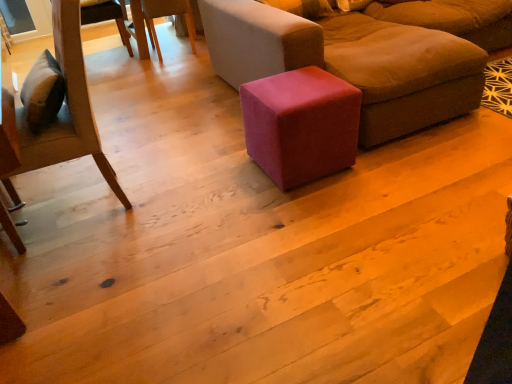
Question: Does wooden chair at upper left, marked as the second chair in a front-to-back arrangement, have a smaller size compared to velvet pink cube at center?

Choices:
 (A) no
 (B) yes

Answer: (A)

Question: Considering the relative sizes of wooden chair at upper left, the 1th chair positioned from the top, and velvet pink cube at center in the image provided, is wooden chair at upper left, the 1th chair positioned from the top, wider than velvet pink cube at center?

Choices:
 (A) yes
 (B) no

Answer: (A)

Question: Considering the relative sizes of wooden chair at upper left, the 1th chair positioned from the back, and velvet pink cube at center in the image provided, is wooden chair at upper left, the 1th chair positioned from the back, thinner than velvet pink cube at center?

Choices:
 (A) yes
 (B) no

Answer: (B)

Question: Can you confirm if wooden chair at upper left, the 1th chair positioned from the top, is positioned to the left of velvet pink cube at center?

Choices:
 (A) no
 (B) yes

Answer: (B)

Question: From the image's perspective, does wooden chair at upper left, marked as the second chair in a front-to-back arrangement, appear lower than velvet pink cube at center?

Choices:
 (A) no
 (B) yes

Answer: (A)

Question: Can you confirm if wooden chair at upper left, marked as the second chair in a front-to-back arrangement, is bigger than velvet pink cube at center?

Choices:
 (A) no
 (B) yes

Answer: (B)

Question: Is velvet pink cube at center far away from velvet brown ottoman at center?

Choices:
 (A) no
 (B) yes

Answer: (A)

Question: Is velvet pink cube at center completely or partially outside of velvet brown ottoman at center?

Choices:
 (A) no
 (B) yes

Answer: (A)

Question: From a real-world perspective, is velvet pink cube at center on velvet brown ottoman at center?

Choices:
 (A) no
 (B) yes

Answer: (A)

Question: Is the position of velvet pink cube at center less distant than that of velvet brown ottoman at center?

Choices:
 (A) no
 (B) yes

Answer: (A)

Question: From the image's perspective, is velvet pink cube at center on top of velvet brown ottoman at center?

Choices:
 (A) no
 (B) yes

Answer: (A)

Question: Are velvet pink cube at center and velvet brown ottoman at center beside each other?

Choices:
 (A) no
 (B) yes

Answer: (A)

Question: Considering the relative sizes of wooden chair at left, which appears as the 1th chair when viewed from the front, and velvet brown ottoman at center in the image provided, is wooden chair at left, which appears as the 1th chair when viewed from the front, shorter than velvet brown ottoman at center?

Choices:
 (A) yes
 (B) no

Answer: (B)